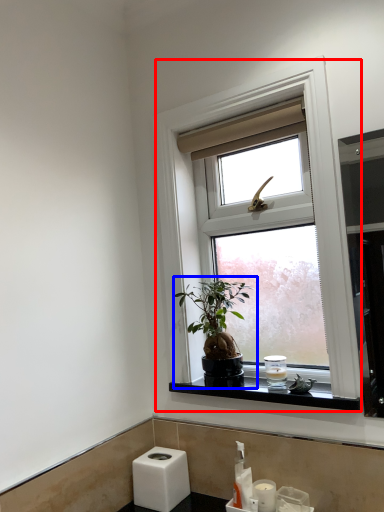
Question: Among these objects, which one is nearest to the camera, window (highlighted by a red box) or houseplant (highlighted by a blue box)?

Choices:
 (A) window
 (B) houseplant

Answer: (A)